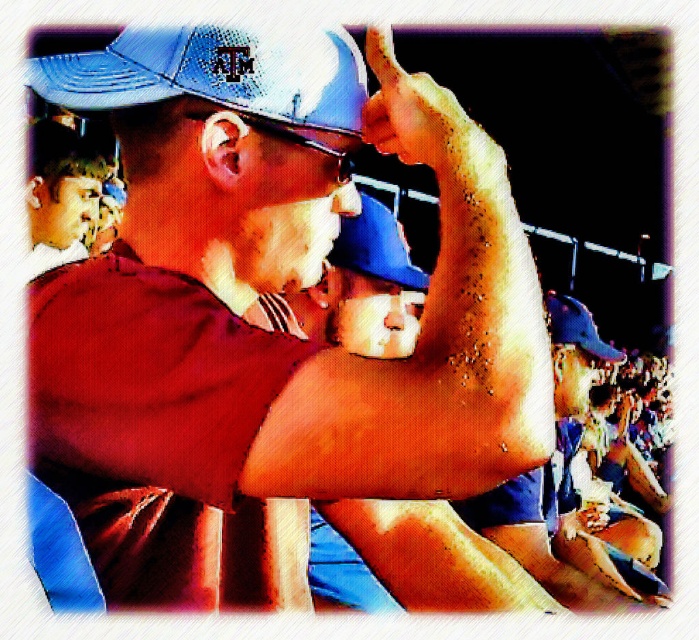
You are standing at the point labeled point (259, 52) and want to walk towards the point labeled point (75, 256). Which direction should you move?

You should move backward because point (259, 52) is in front of point (75, 256).

You are a photographer at the baseball game and need to decide which cap to focus on for a closeup shot. The matte blue cap at center and the blue textured baseball cap at upper center are both in view. Which one is taller?

The matte blue cap at center is taller than the blue textured baseball cap at upper center.

You are a photographer taking a picture of the crowd at the baseball game. You notice the matte blue cap at center and the blue textured baseball cap at upper center. Which cap will appear larger in the photo?

The matte blue cap at center will appear larger in the photo because it is positioned in front of the blue textured baseball cap at upper center.